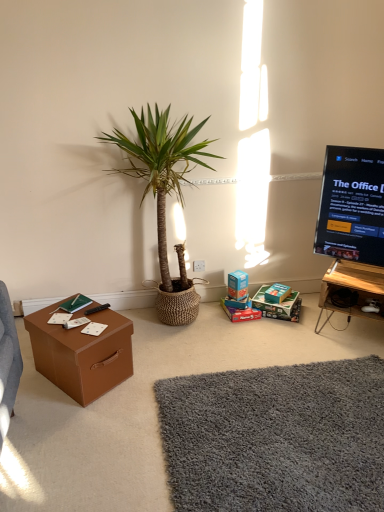
The image size is (384, 512). I want to click on vacant area that is in front of green woven pot at center, so click(168, 370).